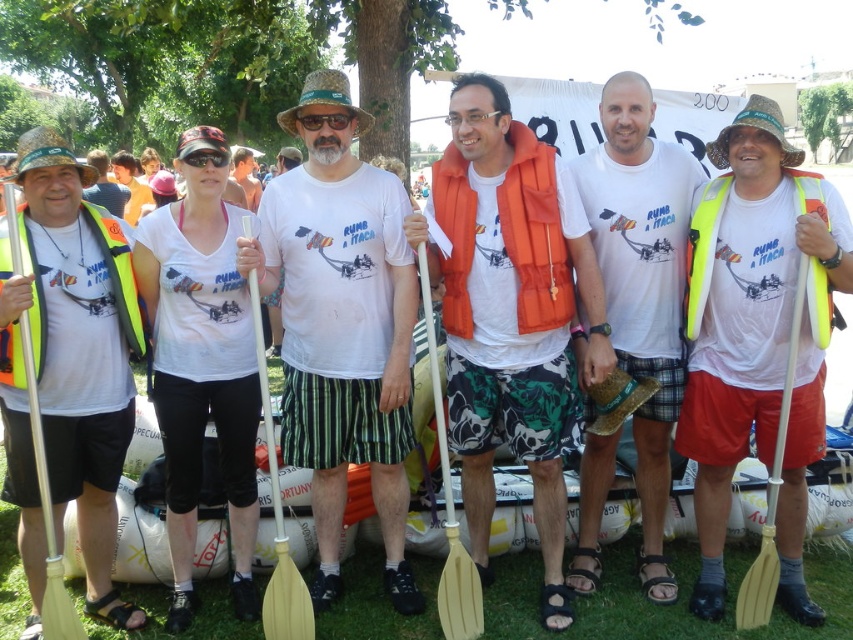
You are standing in front of the group of six people in white Tshirts and safety vests holding paddles. There are two points marked in the image at coordinates point (403,604) and point (105,221). Which of these two points is closer to you?

Point (105,221) is closer to you because it is less far from the camera than point (403,604).